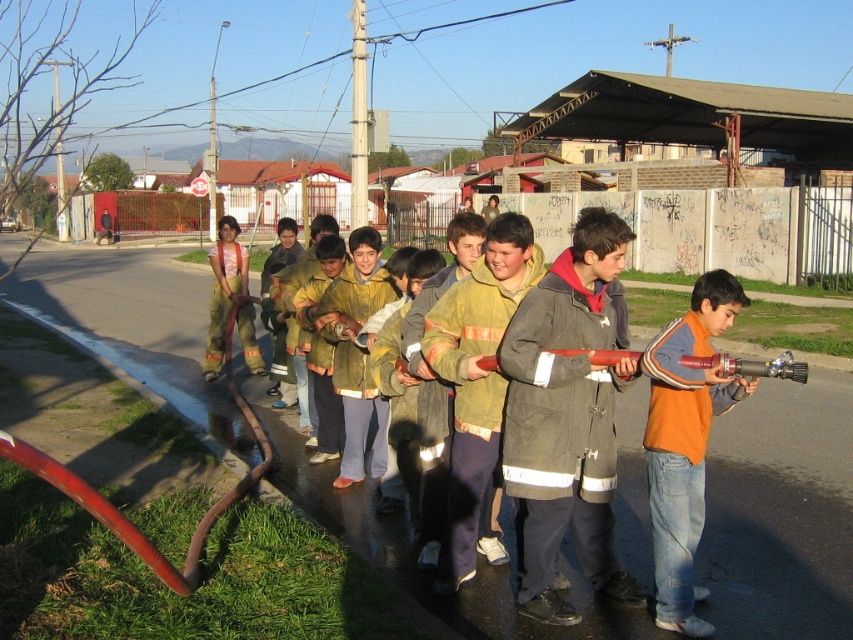
You are a photographer trying to capture a clear photo of the orange fleece jacket at center and the yellow fire jacket at center. Which jacket is blocking the view of the other?

The orange fleece jacket at center is positioned under the yellow fire jacket at center, so the yellow fire jacket at center is blocking the view of the orange fleece jacket at center.